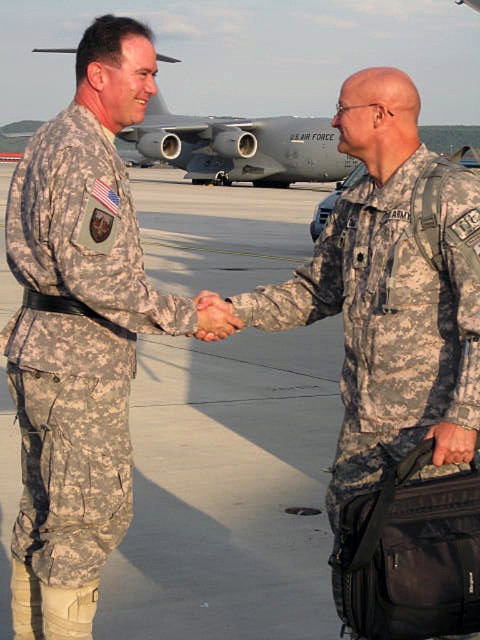
You are a photographer taking a picture of the two individuals shaking hands. You want to focus on the point closer to the camera. Which point should you select between point (108, 285) and point (205, 314)?

Point (108, 285) is closer to the camera than point (205, 314), so you should select point (108, 285).

What are the coordinates of the camouflage fabric pants at left?

The camouflage fabric pants at left are located at coordinates point (x=75, y=342).